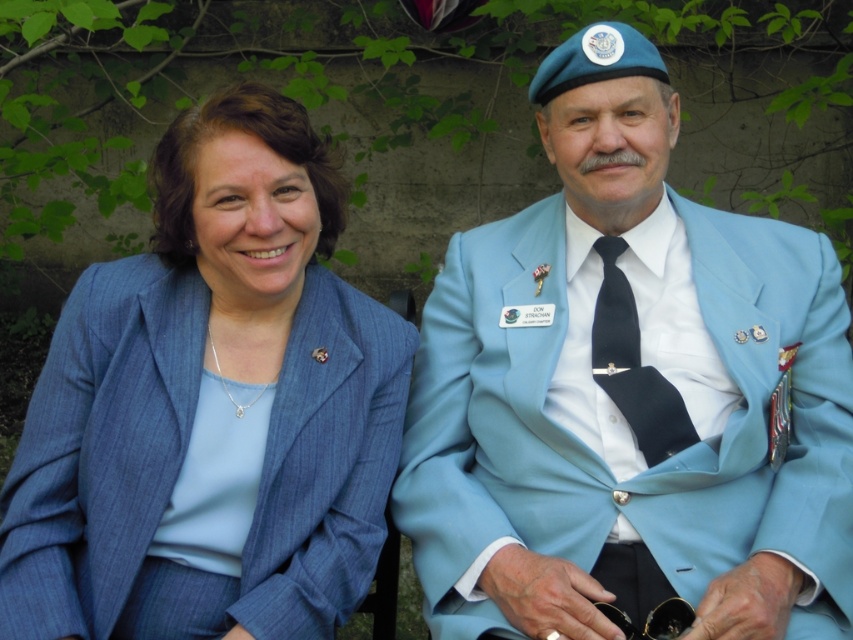
You are a photographer planning to take a group photo of the two people in the image. You need to ensure that both suits are clearly visible in the photo. Given that the light blue suit at center is bigger than the matte blue suit at left, which suit should be positioned closer to the camera to ensure both are equally visible?

The matte blue suit at left should be positioned closer to the camera because it is smaller than the light blue suit at center. This way, both suits will appear similarly sized in the photo.

You are a photographer setting up for a group photo. You need to arrange two people in front of you so that their suits are visible. The light blue suit at center and the matte blue suit at left are the two suits you need to consider. Which person should stand closer to the camera to ensure their suit is fully visible?

The light blue suit at center is wider than the matte blue suit at left, so the person wearing the matte blue suit at left should stand closer to the camera to ensure their narrower suit is fully visible.

You are a photographer setting up a shoot for two models wearing the light blue suit at center and the matte blue suit at left. You need to position them so that their heights are visually balanced in the frame. Which model should you place closer to the camera?

The light blue suit at center is much taller than the matte blue suit at left, so you should place the light blue suit at center further back from the camera and the matte blue suit at left closer to the camera to balance their apparent heights.